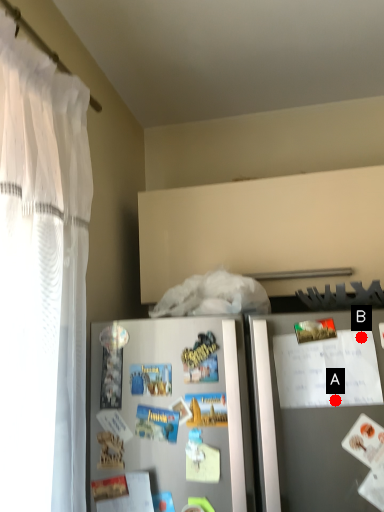
Question: Two points are circled on the image, labeled by A and B beside each circle. Which point appears farthest from the camera in this image?

Choices:
 (A) A is further
 (B) B is further

Answer: (B)